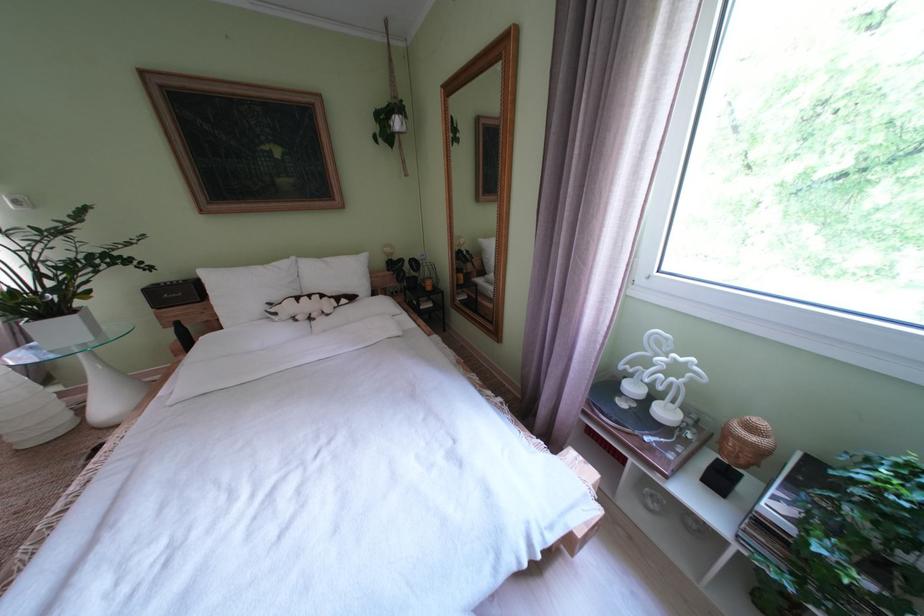
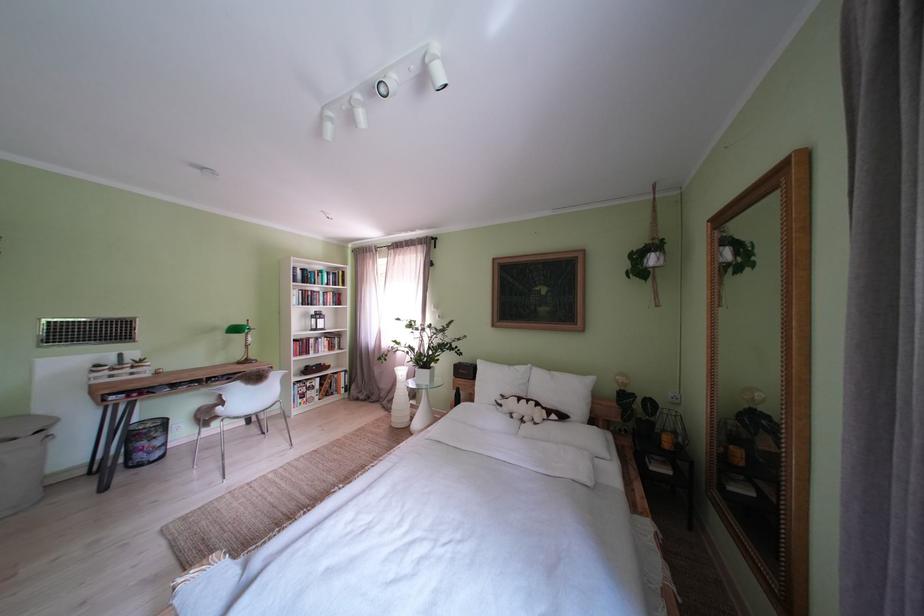
Find the pixel in the second image that matches (305,262) in the first image.

(541, 371)